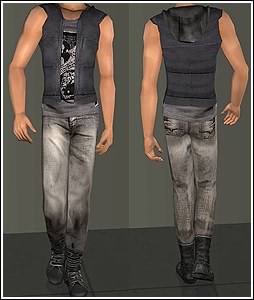
Find the location of a particular element. dark gray floor is located at coordinates (123, 265).